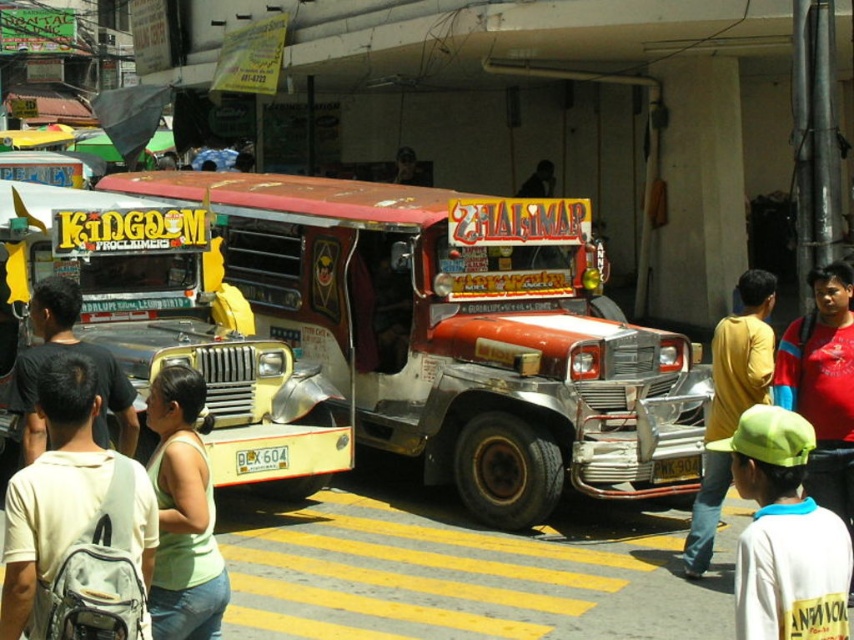
Does yellow matte jeepney at left have a greater width compared to white cotton shirt at lower right?

Yes.

Which is behind, point (67, 198) or point (829, 598)?

Positioned behind is point (67, 198).

I want to click on yellow matte jeepney at left, so click(177, 324).

Is yellow matte jeepney at left wider than red matte shirt at center right?

Indeed, yellow matte jeepney at left has a greater width compared to red matte shirt at center right.

Can you confirm if yellow matte jeepney at left is positioned to the right of red matte shirt at center right?

No, yellow matte jeepney at left is not to the right of red matte shirt at center right.

What do you see at coordinates (177, 324) in the screenshot? This screenshot has height=640, width=854. I see `yellow matte jeepney at left` at bounding box center [177, 324].

Where is `yellow matte jeepney at left`? The width and height of the screenshot is (854, 640). yellow matte jeepney at left is located at coordinates (177, 324).

Find the location of `light green fabric at center`. light green fabric at center is located at coordinates (183, 515).

Can you confirm if light green fabric at center is bigger than light green shirt at center?

Incorrect, light green fabric at center is not larger than light green shirt at center.

Between point (224, 579) and point (97, 365), which one is positioned behind?

Point (97, 365)

Where is `light green fabric at center`? light green fabric at center is located at coordinates click(x=183, y=515).